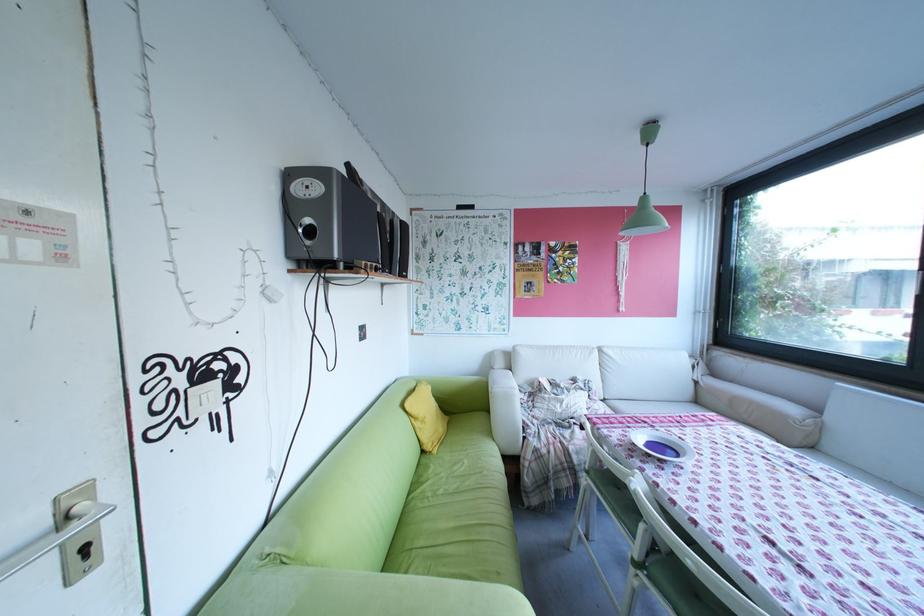
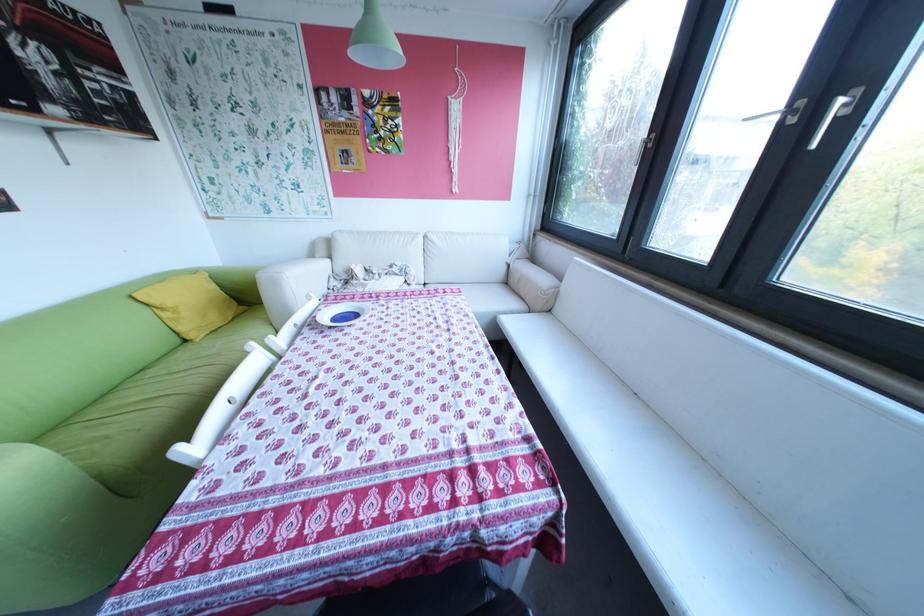
Locate, in the second image, the point that corresponds to pixel 616 400 in the first image.

(438, 284)